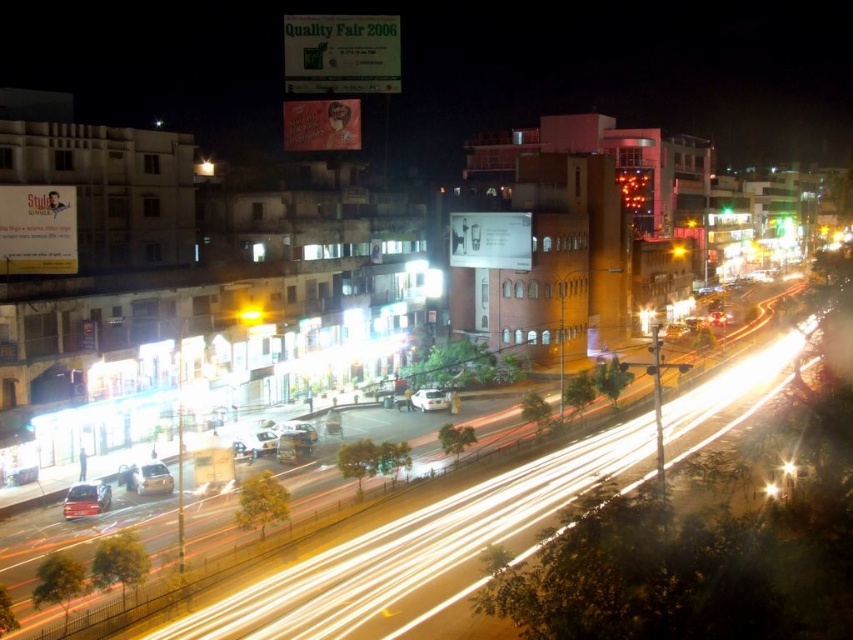
You are a photographer standing at the elevated vantage point capturing the nighttime scene. You notice the white matte car at center and the yellow glass light at center in your shot. Which object appears closer to you in the photograph?

The white matte car at center appears closer to you than the yellow glass light at center because it is further to the viewer.

You are a photographer standing at the edge of the road in this scene. You notice the gold metallic car at lower left and the yellow glass light at center. Which object is closer to your position?

The gold metallic car at lower left is closer to you than the yellow glass light at center because it appears shorter in the image, which often indicates proximity in such compositions.